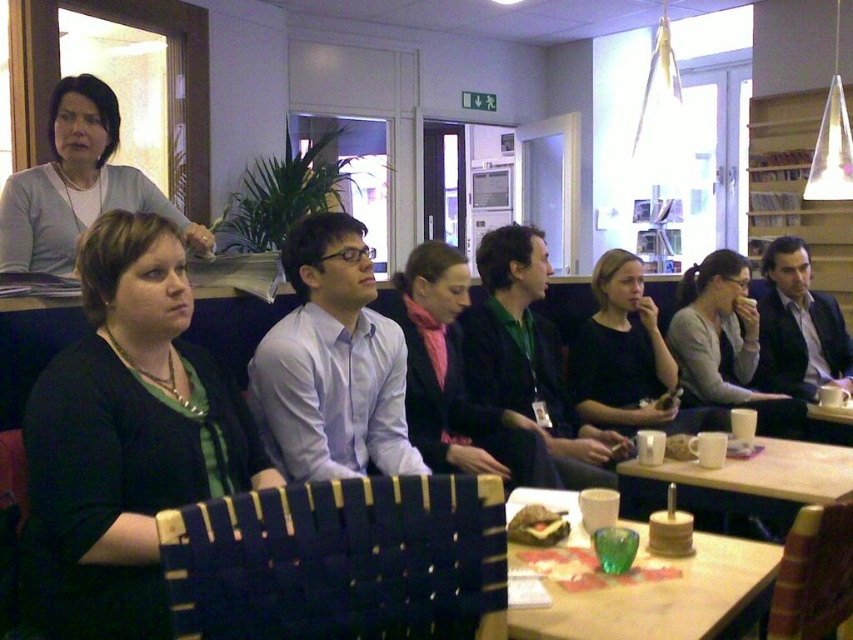
Question: Which of the following is the closest to the observer?

Choices:
 (A) matte gray sweater at upper left
 (B) black matte shirt at center
 (C) translucent green glass at lower center
 (D) matte gray sweater at center

Answer: (C)

Question: Estimate the real-world distances between objects in this image. Which object is closer to the matte gray sweater at upper left?

Choices:
 (A) white ceramic cups at lower right
 (B) black matte shirt at center
 (C) black matte sweater at center

Answer: (C)

Question: From the image, what is the correct spatial relationship of black matte shirt at center in relation to matte brown sandwich at center?

Choices:
 (A) above
 (B) below

Answer: (A)

Question: Among these objects, which one is farthest from the camera?

Choices:
 (A) translucent green glass at lower center
 (B) black matte shirt at center
 (C) matte gray sweater at upper left

Answer: (B)

Question: Is black matte sweater at center smaller than black matte shirt at center?

Choices:
 (A) yes
 (B) no

Answer: (A)

Question: Can you confirm if dark green sweater at center is smaller than white ceramic cups at lower right?

Choices:
 (A) no
 (B) yes

Answer: (A)